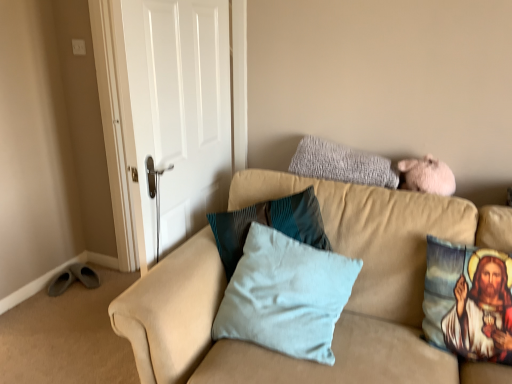
Question: Can you confirm if printed fabric pillow with religious image at right, positioned as the 1th pillow in right-to-left order, is bigger than white matte door at upper left?

Choices:
 (A) no
 (B) yes

Answer: (A)

Question: Is the position of printed fabric pillow with religious image at right, the third pillow when ordered from left to right, less distant than that of white matte door at upper left?

Choices:
 (A) yes
 (B) no

Answer: (A)

Question: From the image's perspective, is printed fabric pillow with religious image at right, the third pillow when ordered from left to right, on top of white matte door at upper left?

Choices:
 (A) no
 (B) yes

Answer: (A)

Question: From a real-world perspective, is printed fabric pillow with religious image at right, the third pillow when ordered from left to right, physically below white matte door at upper left?

Choices:
 (A) yes
 (B) no

Answer: (A)

Question: Is printed fabric pillow with religious image at right, positioned as the 1th pillow in right-to-left order, outside white matte door at upper left?

Choices:
 (A) no
 (B) yes

Answer: (B)

Question: In terms of height, does beige fabric couch at upper right look taller or shorter compared to printed fabric pillow with religious image at right, the third pillow when ordered from left to right?

Choices:
 (A) short
 (B) tall

Answer: (B)

Question: Based on their sizes in the image, would you say beige fabric couch at upper right is bigger or smaller than printed fabric pillow with religious image at right, positioned as the 1th pillow in right-to-left order?

Choices:
 (A) big
 (B) small

Answer: (A)

Question: Considering the positions of beige fabric couch at upper right and printed fabric pillow with religious image at right, the third pillow when ordered from left to right, in the image, is beige fabric couch at upper right wider or thinner than printed fabric pillow with religious image at right, the third pillow when ordered from left to right,?

Choices:
 (A) thin
 (B) wide

Answer: (B)

Question: Is beige fabric couch at upper right to the left or to the right of printed fabric pillow with religious image at right, positioned as the 1th pillow in right-to-left order, in the image?

Choices:
 (A) right
 (B) left

Answer: (B)

Question: In terms of height, does light blue fabric pillow at center, positioned as the first pillow in left-to-right order, look taller or shorter compared to gray fluffy pillow at upper right, placed as the second pillow when sorted from left to right?

Choices:
 (A) tall
 (B) short

Answer: (A)

Question: Is light blue fabric pillow at center, positioned as the first pillow in left-to-right order, spatially inside gray fluffy pillow at upper right, placed as the second pillow when sorted from left to right, or outside of it?

Choices:
 (A) inside
 (B) outside

Answer: (B)

Question: In terms of width, does light blue fabric pillow at center, the third pillow positioned from the right, look wider or thinner when compared to gray fluffy pillow at upper right, which is the second pillow in right-to-left order?

Choices:
 (A) thin
 (B) wide

Answer: (B)

Question: In the image, is light blue fabric pillow at center, the third pillow positioned from the right, positioned in front of or behind gray fluffy pillow at upper right, placed as the second pillow when sorted from left to right?

Choices:
 (A) behind
 (B) front

Answer: (B)

Question: In the image, is white matte door at upper left positioned in front of or behind printed fabric pillow with religious image at right, the third pillow when ordered from left to right?

Choices:
 (A) behind
 (B) front

Answer: (A)

Question: Is point (182, 226) positioned closer to the camera than point (446, 332)?

Choices:
 (A) farther
 (B) closer

Answer: (A)